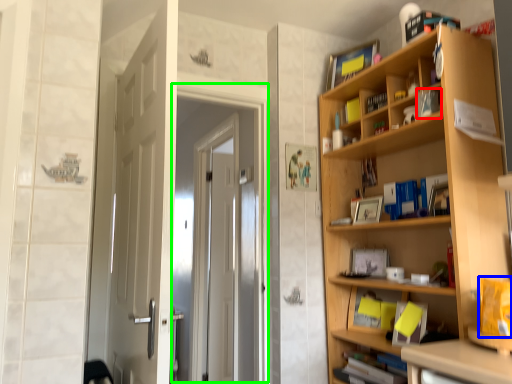
Question: Which object is the farthest from book (highlighted by a red box)? Choose among these: book (highlighted by a blue box) or screen door (highlighted by a green box).

Choices:
 (A) book
 (B) screen door

Answer: (B)